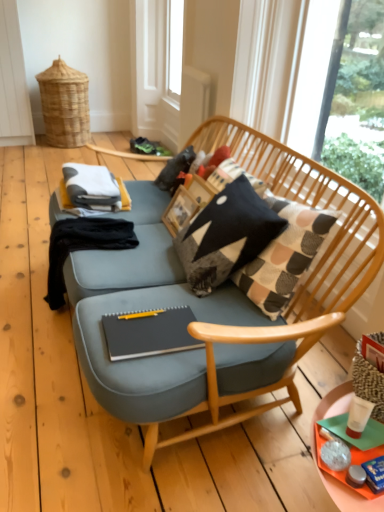
Question: Considering the relative positions of black fabric at left and orange plastic tray at lower right in the image provided, is black fabric at left behind orange plastic tray at lower right?

Choices:
 (A) yes
 (B) no

Answer: (A)

Question: Considering the relative sizes of black fabric at left and orange plastic tray at lower right in the image provided, is black fabric at left bigger than orange plastic tray at lower right?

Choices:
 (A) yes
 (B) no

Answer: (A)

Question: From the image's perspective, does black fabric at left appear lower than orange plastic tray at lower right?

Choices:
 (A) yes
 (B) no

Answer: (B)

Question: Would you say black fabric at left is outside orange plastic tray at lower right?

Choices:
 (A) no
 (B) yes

Answer: (B)

Question: Is black fabric at left at the left side of orange plastic tray at lower right?

Choices:
 (A) no
 (B) yes

Answer: (B)

Question: Which is correct: transparent glass window at upper right is inside orange plastic tray at lower right, or outside of it?

Choices:
 (A) outside
 (B) inside

Answer: (A)

Question: Considering the positions of transparent glass window at upper right and orange plastic tray at lower right in the image, is transparent glass window at upper right taller or shorter than orange plastic tray at lower right?

Choices:
 (A) short
 (B) tall

Answer: (B)

Question: Is point (309, 91) positioned closer to the camera than point (339, 486)?

Choices:
 (A) farther
 (B) closer

Answer: (A)

Question: From a real-world perspective, is transparent glass window at upper right above or below orange plastic tray at lower right?

Choices:
 (A) above
 (B) below

Answer: (A)

Question: Is point (218, 231) closer or farther from the camera than point (375, 88)?

Choices:
 (A) closer
 (B) farther

Answer: (A)

Question: Would you say knitted fabric pillow at center is to the left or to the right of transparent glass window at upper right in the picture?

Choices:
 (A) left
 (B) right

Answer: (A)

Question: Considering the positions of knitted fabric pillow at center and transparent glass window at upper right in the image, is knitted fabric pillow at center taller or shorter than transparent glass window at upper right?

Choices:
 (A) short
 (B) tall

Answer: (A)

Question: From the image's perspective, is knitted fabric pillow at center above or below transparent glass window at upper right?

Choices:
 (A) above
 (B) below

Answer: (B)

Question: Visually, is transparent plastic screen door at upper center positioned to the left or to the right of transparent glass window at upper right?

Choices:
 (A) right
 (B) left

Answer: (B)

Question: From the image's perspective, relative to transparent glass window at upper right, is transparent plastic screen door at upper center above or below?

Choices:
 (A) above
 (B) below

Answer: (A)